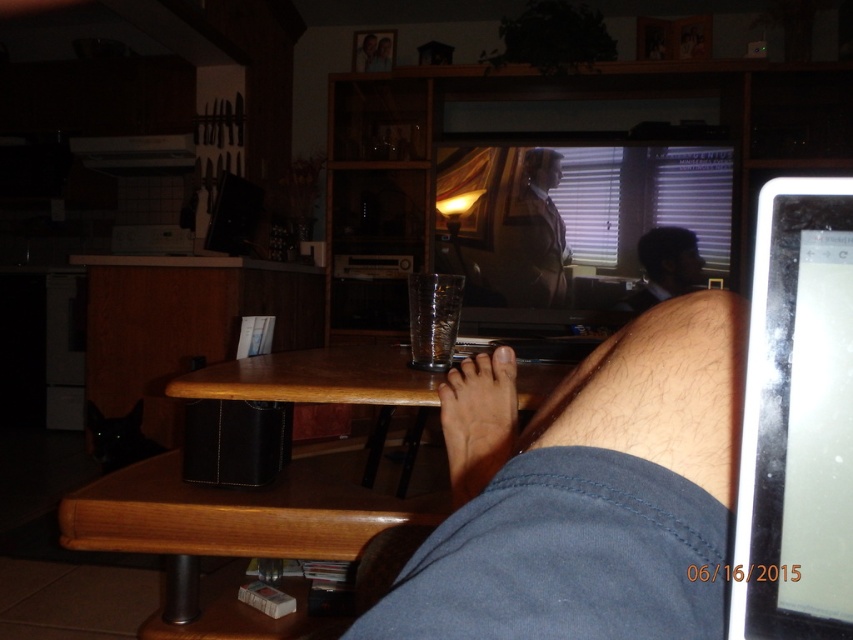
Question: Among these objects, which one is farthest from the camera?

Choices:
 (A) hairy skin at lower right
 (B) wooden table at lower center
 (C) brown skin at lower center

Answer: (C)

Question: Which point is farther from the camera taking this photo?

Choices:
 (A) (540, 248)
 (B) (207, 380)
 (C) (564, 420)

Answer: (A)

Question: Which of these objects is positioned farthest from the matte black laptop at upper center?

Choices:
 (A) matte black tablet at right
 (B) brown skin at lower center
 (C) brown leather jacket at upper center

Answer: (A)

Question: Is wooden table at lower center above brown skin at lower center?

Choices:
 (A) yes
 (B) no

Answer: (B)

Question: Can you confirm if wooden table at lower center is positioned to the left of matte black laptop at upper center?

Choices:
 (A) no
 (B) yes

Answer: (B)

Question: Considering the relative positions of brown leather jacket at upper center and matte black laptop at upper center in the image provided, where is brown leather jacket at upper center located with respect to matte black laptop at upper center?

Choices:
 (A) above
 (B) below

Answer: (A)